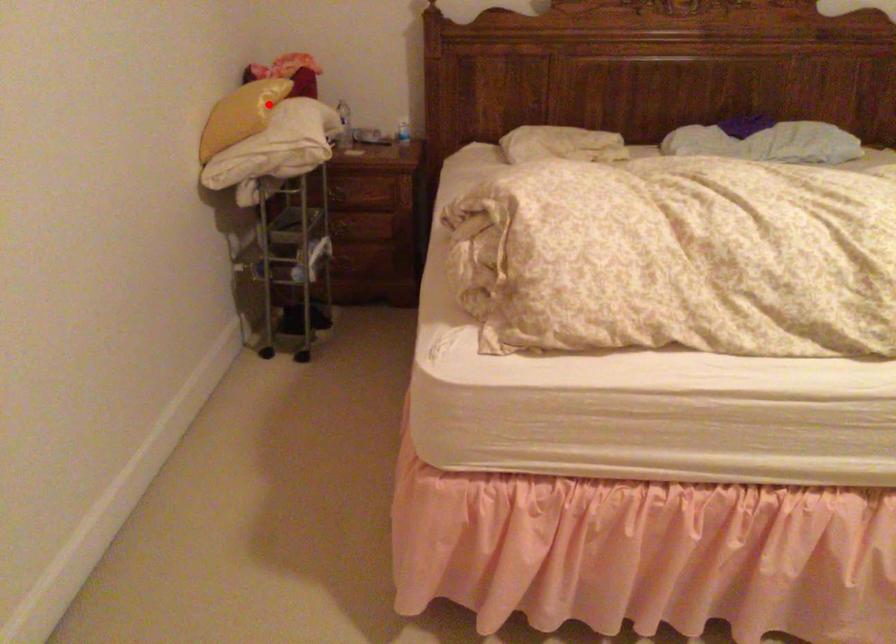
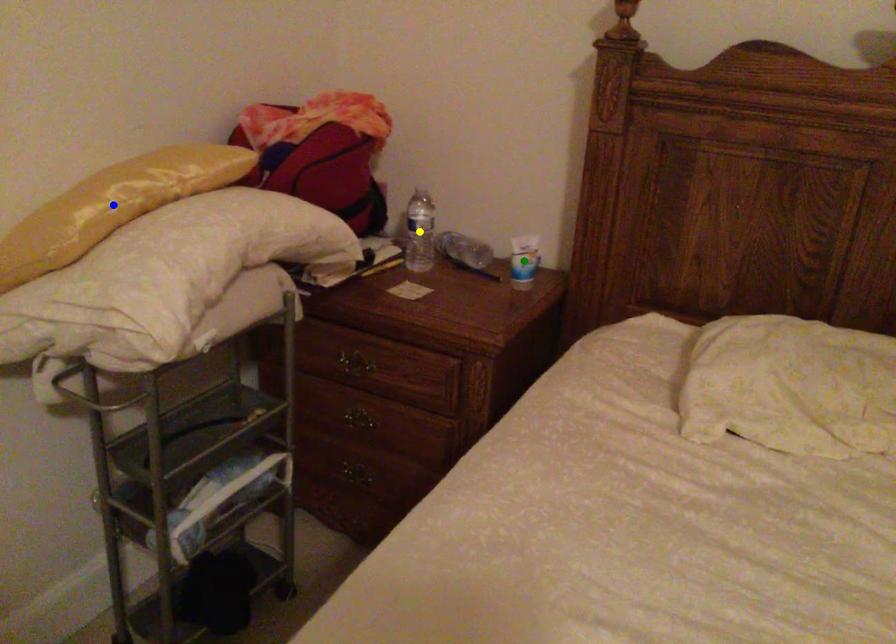
Question: I am providing you with two images of the same scene from different viewpoints. A red point is marked on the first image. You are given multiple points on the second image. Can you choose the point in image 2 that corresponds to the point in image 1?

Choices:
 (A) blue point
 (B) green point
 (C) yellow point

Answer: (A)